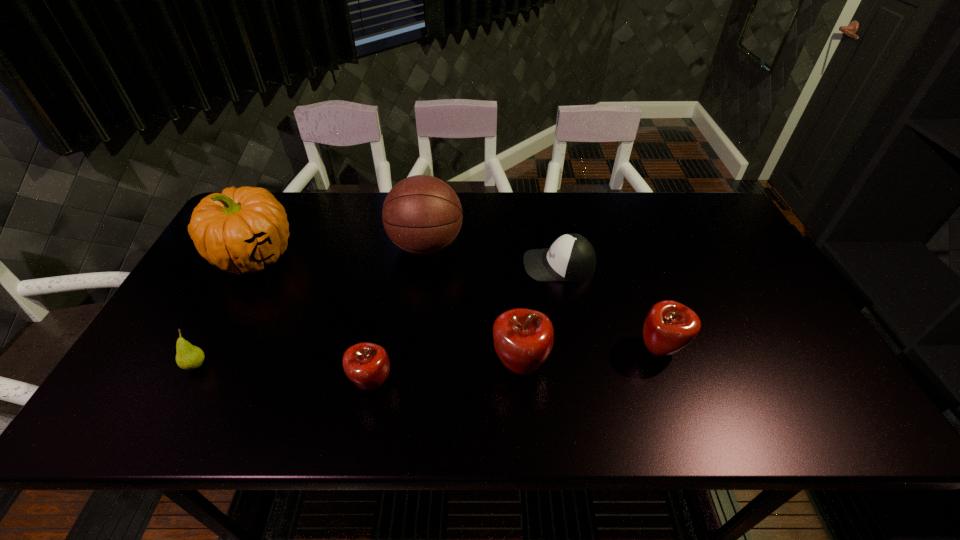
Please show where to add a apple on the right while keeping spacing even. Please provide its 2D coordinates. Your answer should be formatted as a tuple, i.e. [(x, y)], where the tuple contains the x and y coordinates of a point satisfying the conditions above.

[(790, 334)]